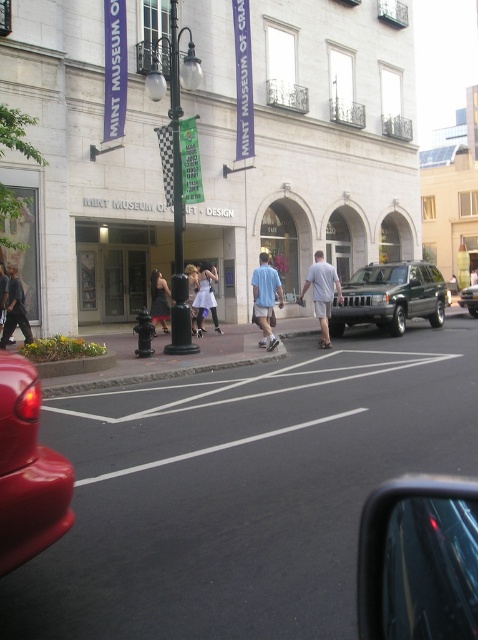
You are standing at the entrance of the Mint Museum of Craft Design and want to take a photo of the shiny black car at lower right without including the museum in the background. Is the car close enough to frame it clearly in your camera?

The shiny black car at lower right is 4.93 meters away from the viewer. Since this distance is within a typical camera lens range, you can frame the car clearly without including the museum in the background.

You are a photographer standing at the entrance of the Mint Museum of Craft Design. You see a shiny black car at lower right and dark gray pants at lower left. Which object is taller?

The dark gray pants at lower left are taller than the shiny black car at lower right.

Where is the light blue cotton shirt at center located in the image?

The light blue cotton shirt at center is located at the coordinates point (322, 292).